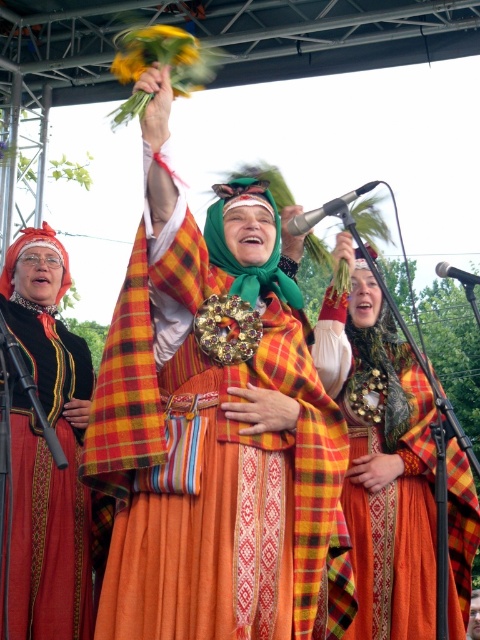
You are a photographer at the event and want to capture the woman in the center. You notice a point at coordinates (215, 436). Which part of her outfit is this point located on?

The point at coordinates (215, 436) is on the plaid fabric dress at center.

You are a photographer at this event and want to capture a closeup of the plaid fabric dress at center and the metallic shiny microphone at upper center. Which object is narrower when viewed from your current position?

The plaid fabric dress at center is narrower than the metallic shiny microphone at upper center.